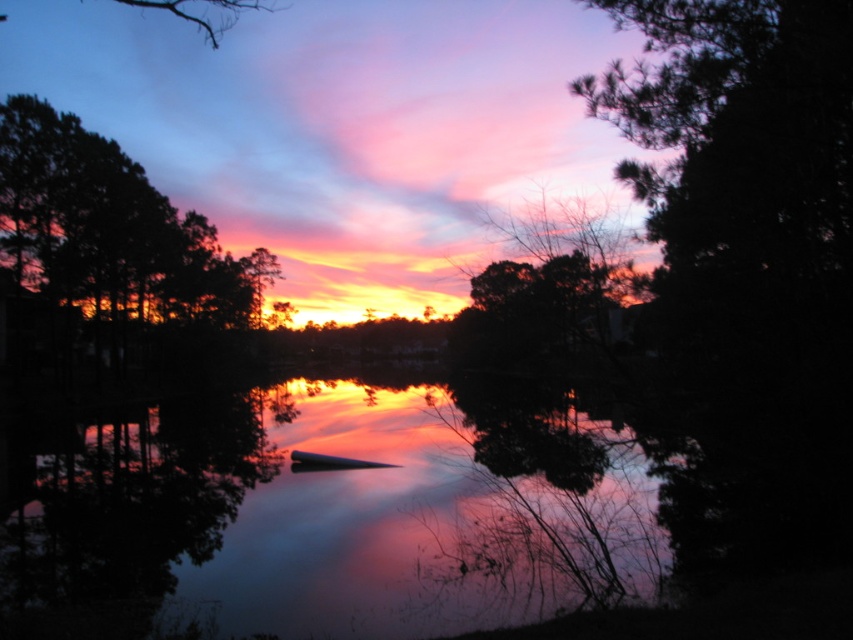
Which is above, smooth water at center or silvery metallic tree at upper center?

silvery metallic tree at upper center is higher up.

Can you confirm if smooth water at center is positioned above silvery metallic tree at upper center?

No, smooth water at center is not above silvery metallic tree at upper center.

Which is behind, point (380, 560) or point (485, 353)?

Point (485, 353)

At what (x,y) coordinates should I click in order to perform the action: click on smooth water at center. Please return your answer as a coordinate pair (x, y). This screenshot has width=853, height=640. Looking at the image, I should click on (326, 515).

Is dark green leafy tree at left taller than silvery metallic tree at upper center?

Incorrect, dark green leafy tree at left's height is not larger of silvery metallic tree at upper center's.

Between dark green leafy tree at left and silvery metallic tree at upper center, which one is positioned lower?

silvery metallic tree at upper center is below.

Where is `dark green leafy tree at left`? dark green leafy tree at left is located at coordinates (111, 230).

Locate an element on the screen. dark green leafy tree at left is located at coordinates (111, 230).

Can you confirm if smooth water at center is positioned above dark green leafy tree at left?

Incorrect, smooth water at center is not positioned above dark green leafy tree at left.

Is the position of smooth water at center more distant than that of dark green leafy tree at left?

That is False.

The image size is (853, 640). What do you see at coordinates (326, 515) in the screenshot? I see `smooth water at center` at bounding box center [326, 515].

Where is `smooth water at center`? smooth water at center is located at coordinates (326, 515).